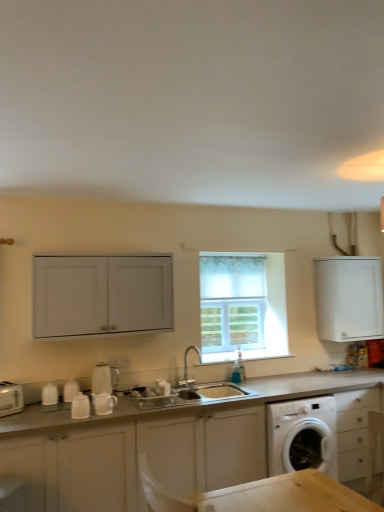
Question: Considering the positions of white plastic toaster at lower left, the first appliance viewed from the left, and silver metallic faucet at center in the image, is white plastic toaster at lower left, the first appliance viewed from the left, wider or thinner than silver metallic faucet at center?

Choices:
 (A) wide
 (B) thin

Answer: (A)

Question: Considering the relative positions of white plastic toaster at lower left, marked as the fourth appliance in a right-to-left arrangement, and silver metallic faucet at center in the image provided, is white plastic toaster at lower left, marked as the fourth appliance in a right-to-left arrangement, to the left or to the right of silver metallic faucet at center?

Choices:
 (A) left
 (B) right

Answer: (A)

Question: Which object is positioned closest to the white glossy kettle at center, the second appliance when ordered from right to left?

Choices:
 (A) satin silver sink at center
 (B) white matte cabinet at center, acting as the 2th cabinetry starting from the left
 (C) white plastic toaster at lower left, the first appliance viewed from the left
 (D) white fabric window at center
 (E) white glossy mugs at lower left, the 2th appliance viewed from the left

Answer: (E)

Question: Which object is the farthest from the white matte cabinet at upper left, the 3th cabinetry viewed from the right?

Choices:
 (A) white glossy kettle at center, the second appliance when ordered from right to left
 (B) white matte cabinet at upper right, acting as the 2th cabinetry starting from the top
 (C) white matte cabinet at center, the 2th cabinetry from the right
 (D) silver metallic faucet at center
 (E) satin silver sink at center

Answer: (B)